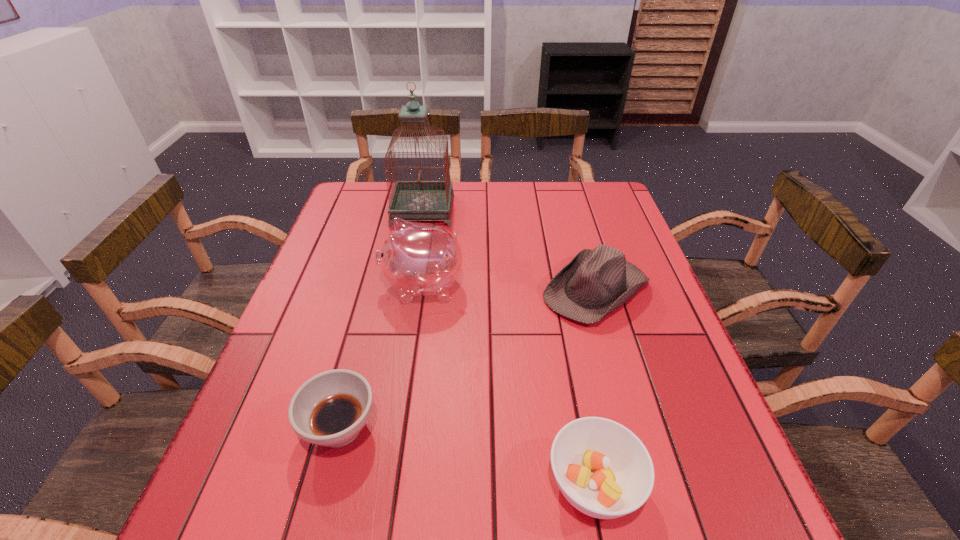
This screenshot has height=540, width=960. What are the coordinates of `free region located on the back of the fedora` in the screenshot? It's located at (567, 193).

I want to click on vacant area situated on the right of the left soup bowl, so click(x=571, y=428).

You are a GUI agent. You are given a task and a screenshot of the screen. Output one action in this format:
    pyautogui.click(x=<x>, y=<y>)
    Task: Click on the free space located 0.140m on the right of the right soup bowl
    
    Given the screenshot: What is the action you would take?
    pyautogui.click(x=724, y=484)

The height and width of the screenshot is (540, 960). Identify the location of object that is at the far edge. (418, 199).

Image resolution: width=960 pixels, height=540 pixels. Identify the location of object located in the near edge section of the desktop. (602, 468).

Find the location of a particular element. Image resolution: width=960 pixels, height=540 pixels. object that is positioned at the left edge is located at coordinates (330, 409).

Find the location of a particular element. The height and width of the screenshot is (540, 960). object that is at the right edge is located at coordinates (594, 283).

Where is `free space at the far edge of the desktop`? The image size is (960, 540). free space at the far edge of the desktop is located at coordinates (540, 211).

In the image, there is a desktop. What are the coordinates of `free space at the near edge` in the screenshot? It's located at (546, 502).

Locate an element on the screen. vacant space at the left edge is located at coordinates (317, 460).